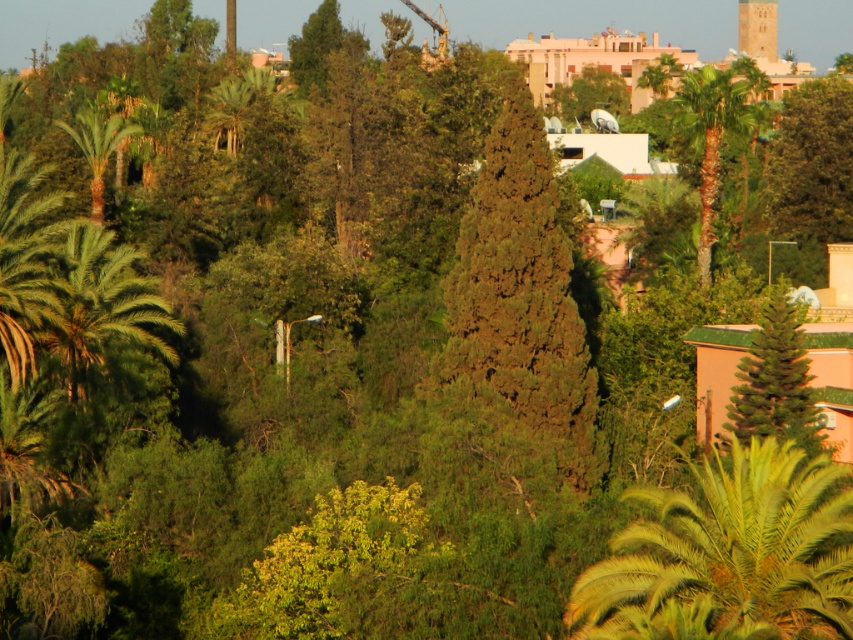
You are a drone operator trying to capture a photo of two specific points in the landscape. The first point is at coordinate point (100,204) and the second is at point (773,22). Given that you want to focus on the point closer to the camera, which coordinate should you adjust your drone to focus on?

Point (100,204) is closer to the camera than point (773,22), so you should focus on point (100,204).

You are a bird flying over the landscape and want to land on the green leafy palm tree at upper right. From your current position above the smooth stone tower at upper right, which direction should you fly to reach the palm tree?

You should fly to the left to reach the green leafy palm tree at upper right from the smooth stone tower at upper right since the palm tree is positioned to the left of the tower.

You are standing in a park and see the green textured tree at right. If you want to take a photo of it with your smartphone, which has a maximum zoom range of 10 meters, can you capture the entire tree without moving closer?

The green textured tree at right is 46.08 meters away from the viewer. Since your smartphone has a maximum zoom range of 10 meters, you cannot capture the entire tree without moving closer.